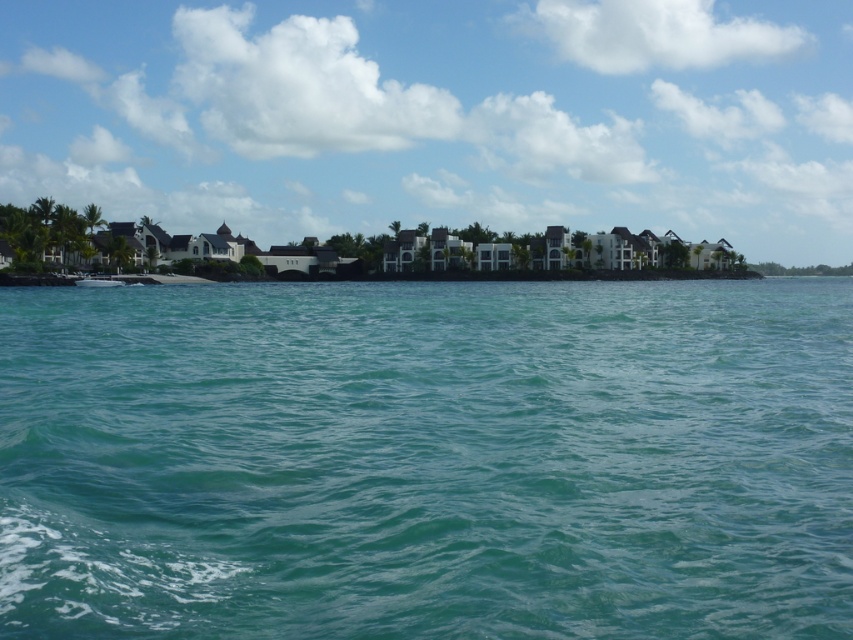
You are standing at the shoreline looking out at the sea. There are two points marked in the image. One is at coordinates point (x=756, y=298) and the other is at point (x=109, y=275). Which point is closer to you?

Point (x=756, y=298) is closer to the viewer than point (x=109, y=275).

You are standing on the beach and see the teal water at center and the white glossy boat at center. Which object is closer to the horizon?

The white glossy boat at center is closer to the horizon because the teal water at center is located below it, meaning the boat is positioned in front of the water from the viewer perspective.